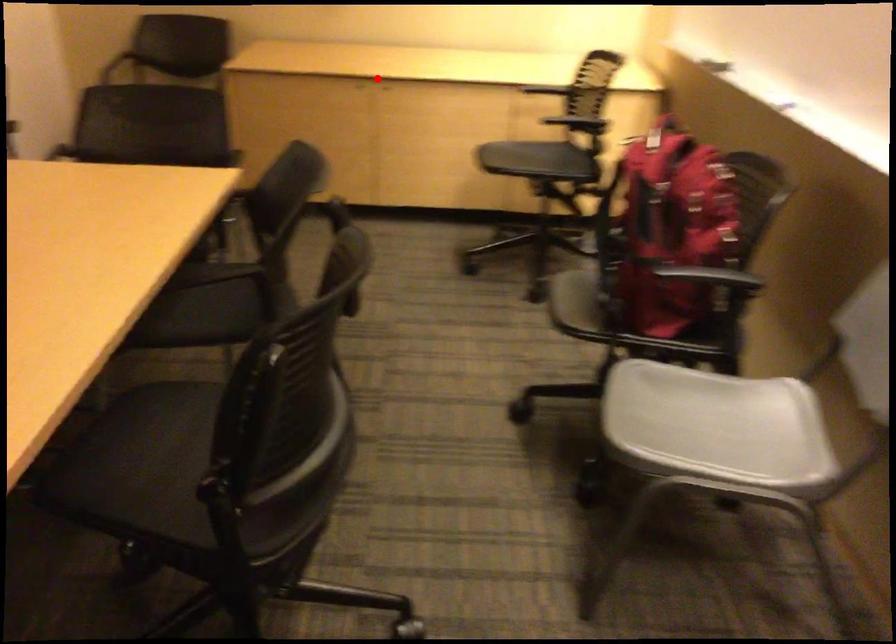
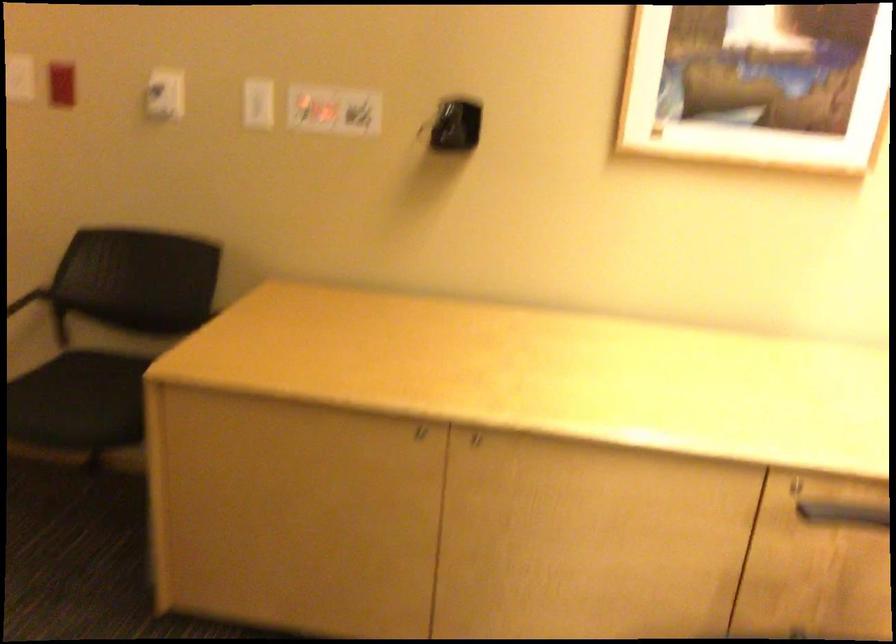
In the second image, find the point that corresponds to the highlighted location in the first image.

(472, 437)